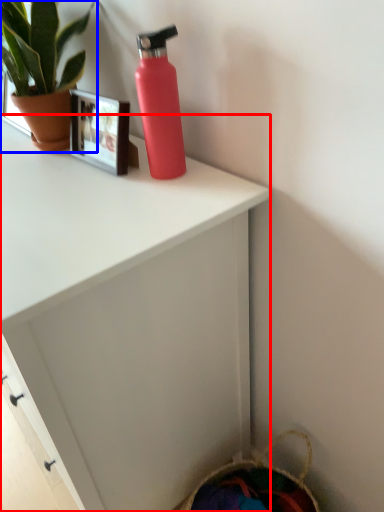
Question: Which of the following is the farthest to the observer, desk (highlighted by a red box) or houseplant (highlighted by a blue box)?

Choices:
 (A) desk
 (B) houseplant

Answer: (B)